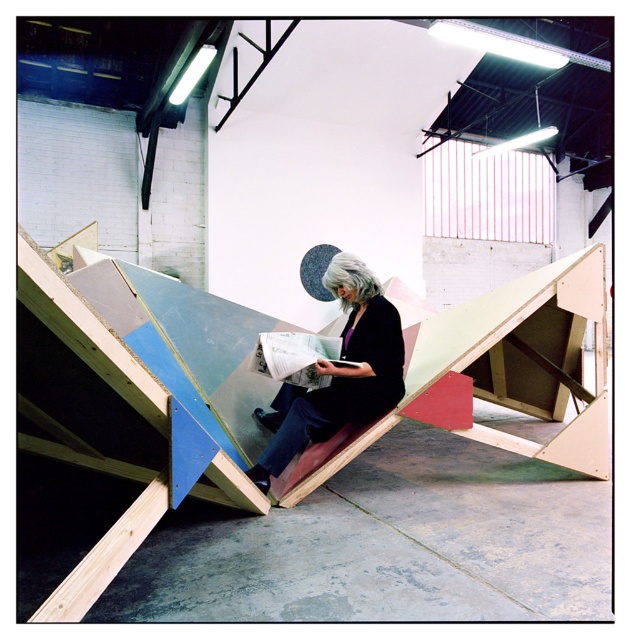
Who is positioned more to the left, wooden ramp at center or matte black jacket at center?

From the viewer's perspective, matte black jacket at center appears more on the left side.

Who is lower down, wooden ramp at center or matte black jacket at center?

matte black jacket at center is below.

What are the coordinates of `wooden ramp at center` in the screenshot? It's located at (133, 394).